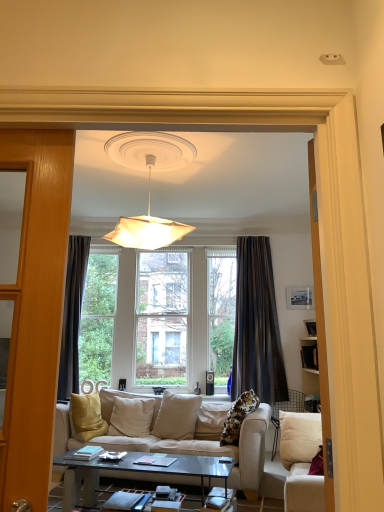
Question: Does white paper lampshade at upper center have a greater width compared to beige fabric couch at center, placed as the 2th studio couch when sorted from front to back?

Choices:
 (A) yes
 (B) no

Answer: (B)

Question: Considering the relative sizes of white paper lampshade at upper center and beige fabric couch at center, placed as the 2th studio couch when sorted from front to back, in the image provided, is white paper lampshade at upper center smaller than beige fabric couch at center, placed as the 2th studio couch when sorted from front to back,?

Choices:
 (A) no
 (B) yes

Answer: (B)

Question: Considering the relative positions of white paper lampshade at upper center and beige fabric couch at center, which is the 1th studio couch in back-to-front order, in the image provided, is white paper lampshade at upper center to the left of beige fabric couch at center, which is the 1th studio couch in back-to-front order, from the viewer's perspective?

Choices:
 (A) no
 (B) yes

Answer: (B)

Question: Can you confirm if white paper lampshade at upper center is shorter than beige fabric couch at center, which is the 1th studio couch in back-to-front order?

Choices:
 (A) yes
 (B) no

Answer: (B)

Question: Is white paper lampshade at upper center turned away from beige fabric couch at center, which is the 1th studio couch in back-to-front order?

Choices:
 (A) yes
 (B) no

Answer: (B)

Question: Is white paper lampshade at upper center not within beige fabric couch at center, which is the 1th studio couch in back-to-front order?

Choices:
 (A) no
 (B) yes

Answer: (B)

Question: Is beige fabric couch at center, which is the 1th studio couch in back-to-front order, to the left of dark gray textured curtain at center from the viewer's perspective?

Choices:
 (A) yes
 (B) no

Answer: (A)

Question: From a real-world perspective, is beige fabric couch at center, which is the 1th studio couch in back-to-front order, physically below dark gray textured curtain at center?

Choices:
 (A) yes
 (B) no

Answer: (A)

Question: Is beige fabric couch at center, which is the 1th studio couch in back-to-front order, not inside dark gray textured curtain at center?

Choices:
 (A) yes
 (B) no

Answer: (A)

Question: Considering the relative sizes of beige fabric couch at center, which is the 1th studio couch in back-to-front order, and dark gray textured curtain at center in the image provided, is beige fabric couch at center, which is the 1th studio couch in back-to-front order, shorter than dark gray textured curtain at center?

Choices:
 (A) yes
 (B) no

Answer: (A)

Question: Is beige fabric couch at center, placed as the 2th studio couch when sorted from front to back, bigger than dark gray textured curtain at center?

Choices:
 (A) yes
 (B) no

Answer: (A)

Question: Is beige fabric couch at center, which is the 1th studio couch in back-to-front order, positioned behind dark gray textured curtain at center?

Choices:
 (A) no
 (B) yes

Answer: (A)

Question: Is beige fabric couch at center, placed as the 2th studio couch when sorted from front to back, next to matte black picture frame at upper right?

Choices:
 (A) yes
 (B) no

Answer: (B)